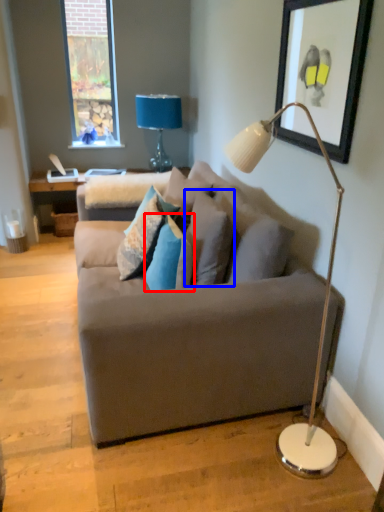
Question: Which object appears closest to the camera in this image, pillow (highlighted by a red box) or pillow (highlighted by a blue box)?

Choices:
 (A) pillow
 (B) pillow

Answer: (A)